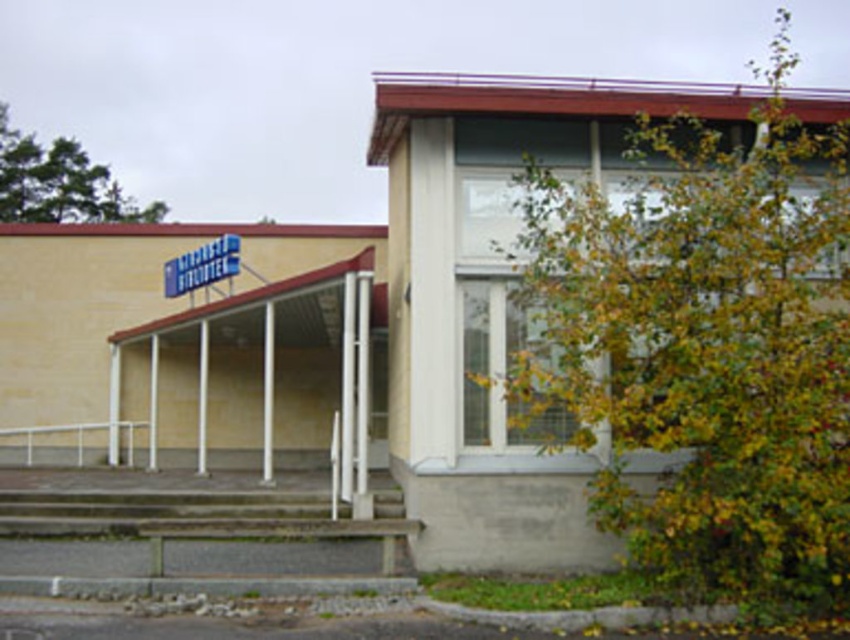
Question: Which point is closer to the camera?

Choices:
 (A) white plastic rail at lower left
 (B) blue plastic sign at upper left

Answer: (B)

Question: Where is blue plastic sign at upper left located in relation to white plastic rail at lower left in the image?

Choices:
 (A) left
 (B) right

Answer: (B)

Question: Does blue plastic sign at upper left have a larger size compared to white plastic rail at lower left?

Choices:
 (A) yes
 (B) no

Answer: (A)

Question: Which point is closer to the camera?

Choices:
 (A) white plastic rail at lower left
 (B) blue plastic sign at upper left

Answer: (B)

Question: From the image, what is the correct spatial relationship of blue plastic sign at upper left in relation to white plastic rail at lower left?

Choices:
 (A) right
 (B) left

Answer: (A)